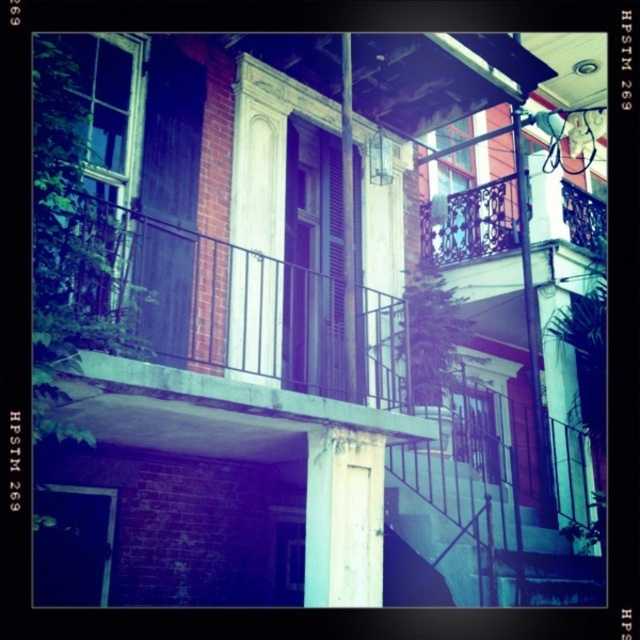
Question: Which of these objects is positioned farthest from the clear glass window at upper left?

Choices:
 (A) clear glass window at upper center
 (B) rustic wood balcony at center

Answer: (A)

Question: Which object is the farthest from the rustic wood balcony at center?

Choices:
 (A) clear glass window at upper center
 (B) clear glass window at upper left

Answer: (A)

Question: Can you confirm if rustic wood balcony at center is smaller than clear glass window at upper left?

Choices:
 (A) no
 (B) yes

Answer: (A)

Question: Is clear glass window at upper left smaller than clear glass window at upper center?

Choices:
 (A) yes
 (B) no

Answer: (B)

Question: Is rustic wood balcony at center behind clear glass window at upper center?

Choices:
 (A) yes
 (B) no

Answer: (B)

Question: Which object is the farthest from the rustic wood balcony at center?

Choices:
 (A) clear glass window at upper center
 (B) clear glass window at upper left

Answer: (A)